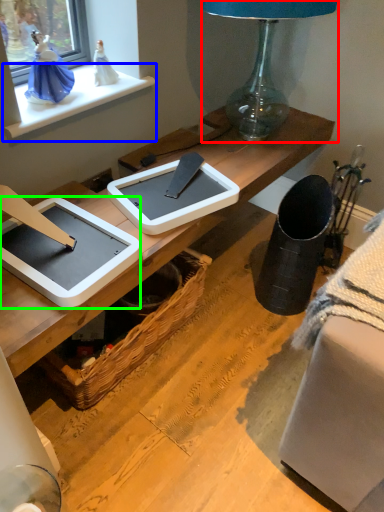
Question: Based on their relative distances, which object is farther from lamp (highlighted by a red box)? Choose from window sill (highlighted by a blue box) and tablet computer (highlighted by a green box).

Choices:
 (A) window sill
 (B) tablet computer

Answer: (B)